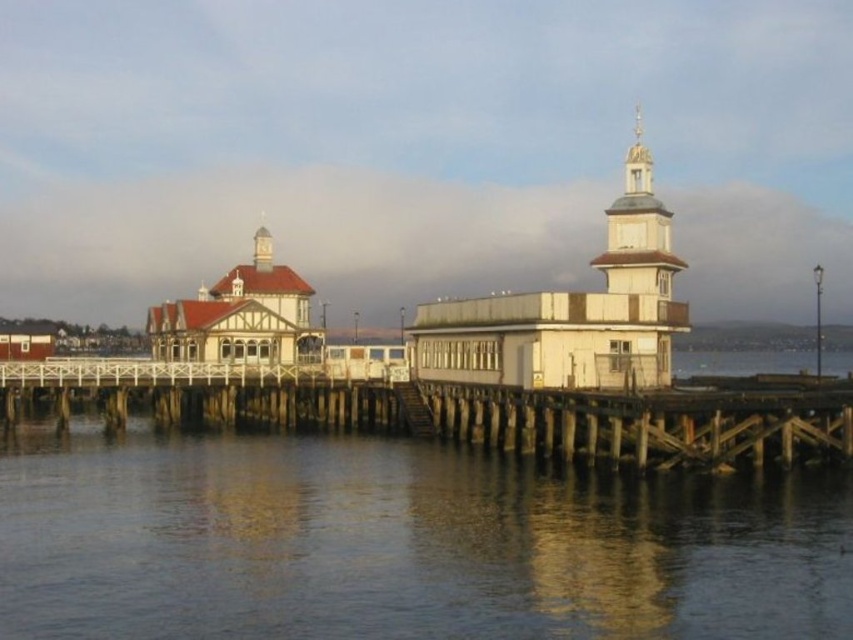
Question: Can you confirm if white wooden tower at center is bigger than wooden spire at upper center?

Choices:
 (A) yes
 (B) no

Answer: (A)

Question: Where is transparent water at lower center located in relation to wooden at lower center in the image?

Choices:
 (A) below
 (B) above

Answer: (A)

Question: Where is wooden at lower center located in relation to wooden spire at upper center in the image?

Choices:
 (A) below
 (B) above

Answer: (A)

Question: Which object appears closest to the camera in this image?

Choices:
 (A) transparent water at lower center
 (B) white wooden tower at center
 (C) wooden at lower center

Answer: (A)

Question: Which point is closer to the camera?

Choices:
 (A) wooden spire at upper center
 (B) wooden at lower center
 (C) transparent water at lower center

Answer: (C)

Question: Which object is the farthest from the white wooden tower at center?

Choices:
 (A) wooden spire at upper center
 (B) wooden at lower center

Answer: (A)